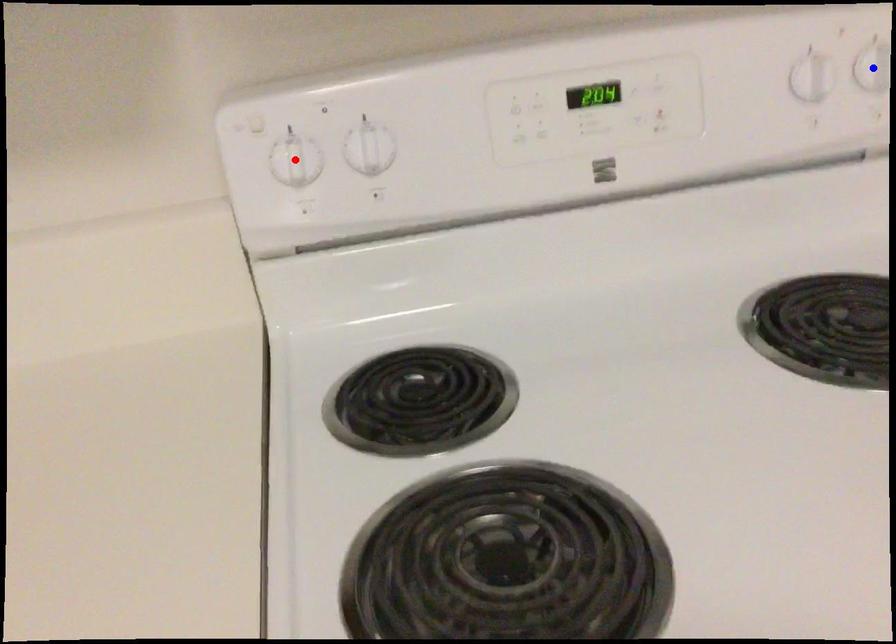
Question: Two points are marked on the image. Which point is closer to the camera?

Choices:
 (A) Blue point is closer.
 (B) Red point is closer.

Answer: (B)